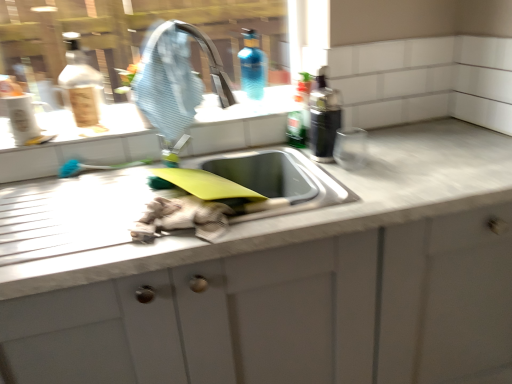
Question: From the image's perspective, is transparent glass window at upper center beneath blue rubber tap at upper center?

Choices:
 (A) yes
 (B) no

Answer: (B)

Question: Does transparent glass window at upper center appear on the left side of blue rubber tap at upper center?

Choices:
 (A) no
 (B) yes

Answer: (B)

Question: From the image's perspective, is transparent glass window at upper center above blue rubber tap at upper center?

Choices:
 (A) yes
 (B) no

Answer: (A)

Question: Does transparent glass window at upper center touch blue rubber tap at upper center?

Choices:
 (A) yes
 (B) no

Answer: (B)

Question: Considering the relative sizes of transparent glass window at upper center and blue rubber tap at upper center in the image provided, is transparent glass window at upper center thinner than blue rubber tap at upper center?

Choices:
 (A) yes
 (B) no

Answer: (A)

Question: Is transparent glass window at upper center behind blue rubber tap at upper center?

Choices:
 (A) no
 (B) yes

Answer: (B)

Question: Is the depth of white marble countertop at center greater than that of black plastic bottle at upper right, which appears as the first bottle when viewed from the right?

Choices:
 (A) yes
 (B) no

Answer: (B)

Question: Is white marble countertop at center to the left of black plastic bottle at upper right, marked as the 3th bottle in a left-to-right arrangement, from the viewer's perspective?

Choices:
 (A) yes
 (B) no

Answer: (A)

Question: From the image's perspective, would you say white marble countertop at center is positioned over black plastic bottle at upper right, marked as the 3th bottle in a left-to-right arrangement?

Choices:
 (A) yes
 (B) no

Answer: (B)

Question: Is white marble countertop at center oriented away from black plastic bottle at upper right, marked as the 3th bottle in a left-to-right arrangement?

Choices:
 (A) no
 (B) yes

Answer: (A)

Question: Considering the relative sizes of white marble countertop at center and black plastic bottle at upper right, marked as the 3th bottle in a left-to-right arrangement, in the image provided, is white marble countertop at center taller than black plastic bottle at upper right, marked as the 3th bottle in a left-to-right arrangement,?

Choices:
 (A) no
 (B) yes

Answer: (B)

Question: Does white marble countertop at center have a lesser height compared to black plastic bottle at upper right, marked as the 3th bottle in a left-to-right arrangement?

Choices:
 (A) yes
 (B) no

Answer: (B)

Question: Could you tell me if blue glass bottle at upper center, arranged as the third bottle when viewed from the right, is facing transparent glass window at upper center?

Choices:
 (A) yes
 (B) no

Answer: (B)